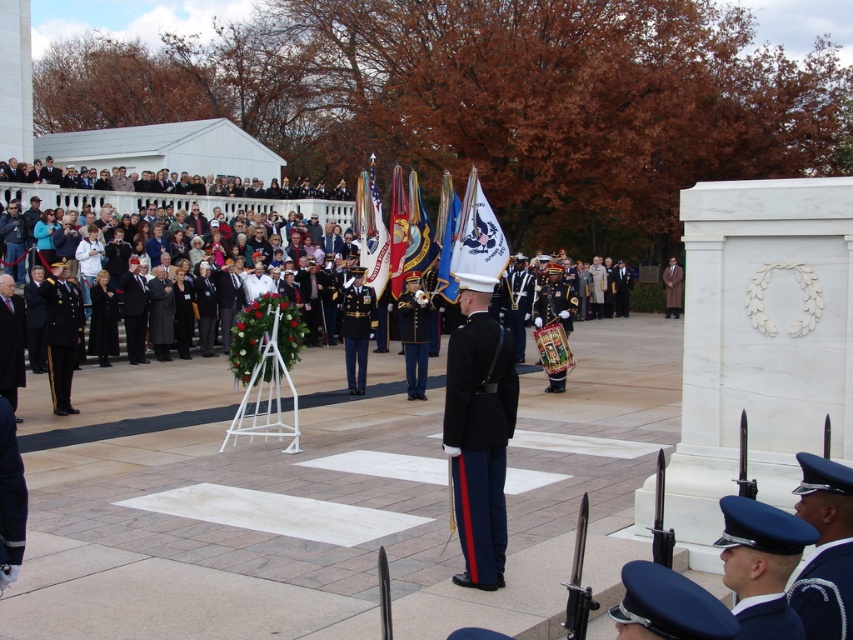
Question: Can you confirm if silk flag at center is smaller than blue fabric uniform at lower right?

Choices:
 (A) yes
 (B) no

Answer: (B)

Question: Does blue uniform at lower right have a smaller size compared to white matte flag at center?

Choices:
 (A) yes
 (B) no

Answer: (A)

Question: Which point is closer to the camera?

Choices:
 (A) shiny dark blue uniform at center
 (B) blue uniform at right
 (C) white matte flag at center
 (D) silk flag at center

Answer: (B)

Question: Which of the following is the closest to the observer?

Choices:
 (A) (49, 369)
 (B) (451, 296)
 (C) (793, 636)

Answer: (C)

Question: Does shiny black uniform at left appear under silk flag at center?

Choices:
 (A) yes
 (B) no

Answer: (A)

Question: Which point is farther to the camera?

Choices:
 (A) white matte flag at center
 (B) blue fabric uniform at lower right
 (C) blue uniform at lower right
 (D) shiny dark blue uniform at center

Answer: (D)